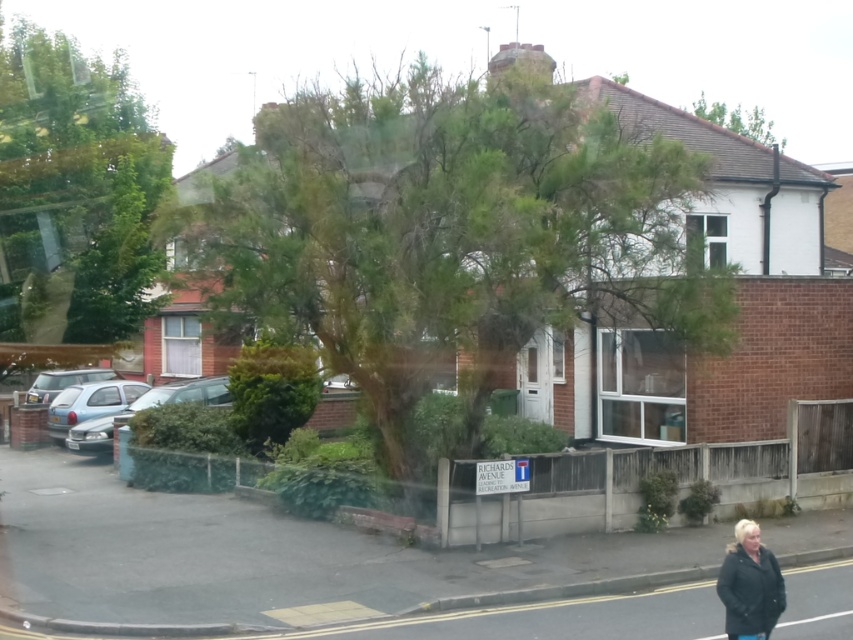
In the scene shown: Who is positioned more to the right, green leafy tree at center or dark gray jacket at lower right?

dark gray jacket at lower right

Does green leafy tree at center come behind dark gray jacket at lower right?

Yes, it is behind dark gray jacket at lower right.

Measure the distance between green leafy tree at center and camera.

A distance of 12.26 meters exists between green leafy tree at center and camera.

The height and width of the screenshot is (640, 853). Find the location of `green leafy tree at center`. green leafy tree at center is located at coordinates (447, 236).

Measure the distance between silver metallic car at lower left and silver metallic car at left.

silver metallic car at lower left is 6.08 meters away from silver metallic car at left.

Which is behind, point (73, 440) or point (100, 369)?

The point (100, 369) is more distant.

Does point (106, 428) come behind point (39, 392)?

No, (106, 428) is closer to viewer.

The image size is (853, 640). In order to click on silver metallic car at lower left in this screenshot , I will do `click(144, 408)`.

In the scene shown: Measure the distance from green leafy tree at upper left to green leafy tree at upper center.

green leafy tree at upper left is 29.81 meters from green leafy tree at upper center.

Which of these two, green leafy tree at upper left or green leafy tree at upper center, stands shorter?

green leafy tree at upper center

Is point (144, 280) positioned in front of point (732, 113)?

That is True.

Where is `green leafy tree at upper left`? The width and height of the screenshot is (853, 640). green leafy tree at upper left is located at coordinates (74, 193).